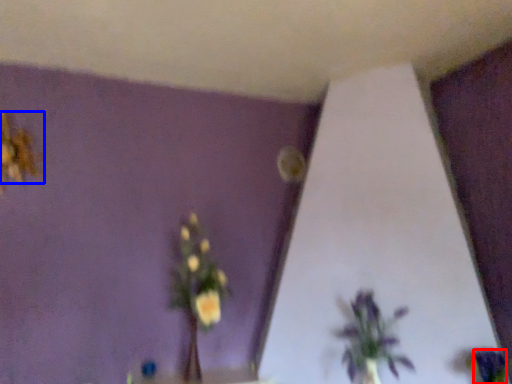
Question: Which object appears closest to the camera in this image, flower (highlighted by a red box) or flower (highlighted by a blue box)?

Choices:
 (A) flower
 (B) flower

Answer: (A)